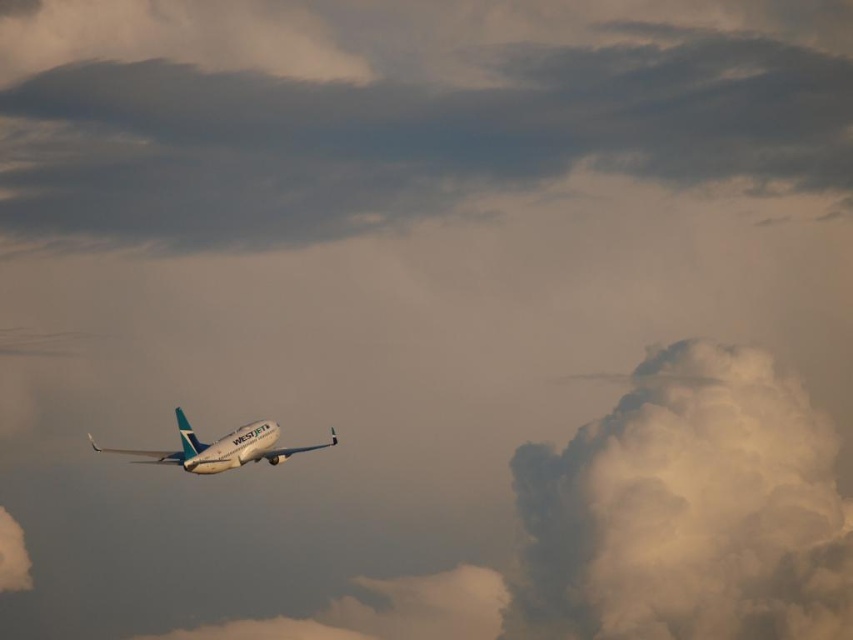
Question: Is white fluffy cloud at upper right wider than white glossy airplane at center?

Choices:
 (A) yes
 (B) no

Answer: (A)

Question: Which object appears farthest from the camera in this image?

Choices:
 (A) white glossy airplane at center
 (B) white fluffy cloud at upper right
 (C) gray fluffy cloud at upper center

Answer: (C)

Question: Which point appears farthest from the camera in this image?

Choices:
 (A) (756, 440)
 (B) (480, 17)
 (C) (250, 436)

Answer: (B)

Question: Does white fluffy cloud at upper right have a smaller size compared to white glossy airplane at center?

Choices:
 (A) yes
 (B) no

Answer: (B)

Question: Can you confirm if gray fluffy cloud at upper center is wider than white fluffy cloud at upper right?

Choices:
 (A) no
 (B) yes

Answer: (B)

Question: Based on their relative distances, which object is farther from the white fluffy cloud at upper right?

Choices:
 (A) gray fluffy cloud at upper center
 (B) white glossy airplane at center

Answer: (B)